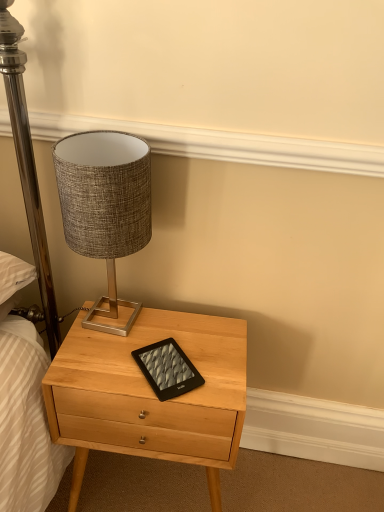
Locate an element on the screen. free space in front of textured fabric lampshade at upper left is located at coordinates (93, 367).